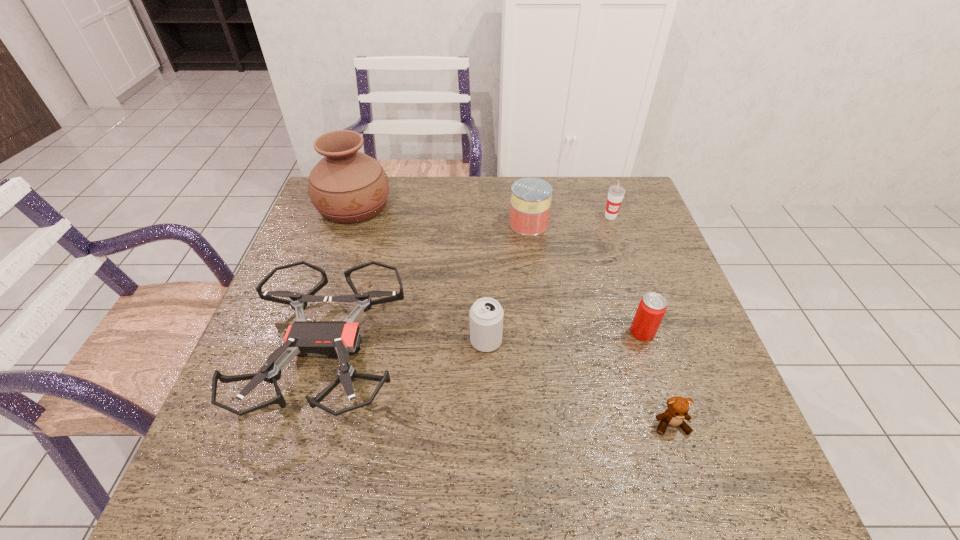
Identify the location of free space between the rightmost can and the cup. The image size is (960, 540). (627, 274).

You are a GUI agent. You are given a task and a screenshot of the screen. Output one action in this format:
    pyautogui.click(x=<x>, y=<y>)
    Task: Click on the object that is the second nearest to the fourth object from right to left
    The height and width of the screenshot is (540, 960).
    Given the screenshot: What is the action you would take?
    pyautogui.click(x=335, y=339)

Identify which object is the fourth closest to the rightmost can. Please provide its 2D coordinates. Your answer should be formatted as a tuple, i.e. [(x, y)], where the tuple contains the x and y coordinates of a point satisfying the conditions above.

[(616, 193)]

Image resolution: width=960 pixels, height=540 pixels. Identify the location of the third closest can to the cup. (486, 314).

Locate an element on the screen. Image resolution: width=960 pixels, height=540 pixels. can that can be found as the closest to the rightmost can is located at coordinates (486, 314).